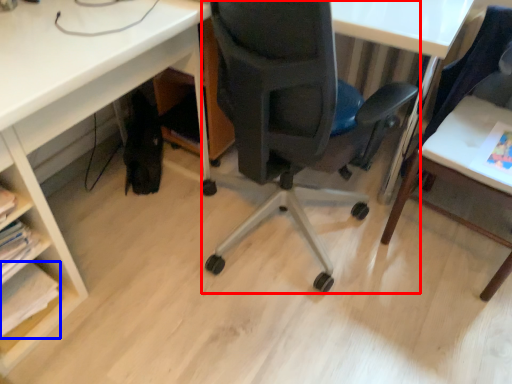
Question: Which object is further to the camera taking this photo, chair (highlighted by a red box) or book (highlighted by a blue box)?

Choices:
 (A) chair
 (B) book

Answer: (B)